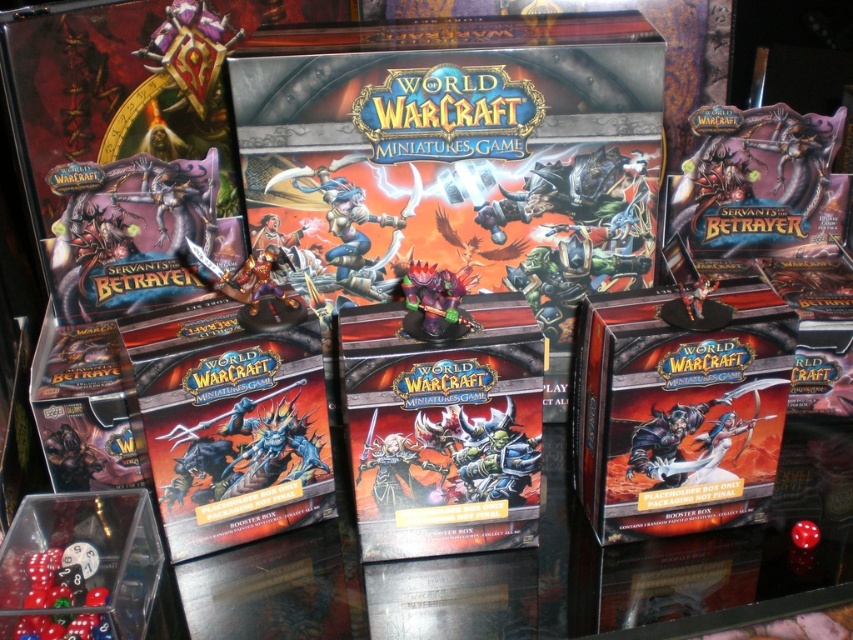
Can you confirm if translucent plastic dice at lower left is positioned to the left of satin purple figurine at center?

Indeed, translucent plastic dice at lower left is positioned on the left side of satin purple figurine at center.

Is translucent plastic dice at lower left to the right of satin purple figurine at center from the viewer's perspective?

In fact, translucent plastic dice at lower left is to the left of satin purple figurine at center.

Describe the element at coordinates (59, 582) in the screenshot. The width and height of the screenshot is (853, 640). I see `translucent plastic dice at lower left` at that location.

The image size is (853, 640). In order to click on translucent plastic dice at lower left in this screenshot , I will do `click(59, 582)`.